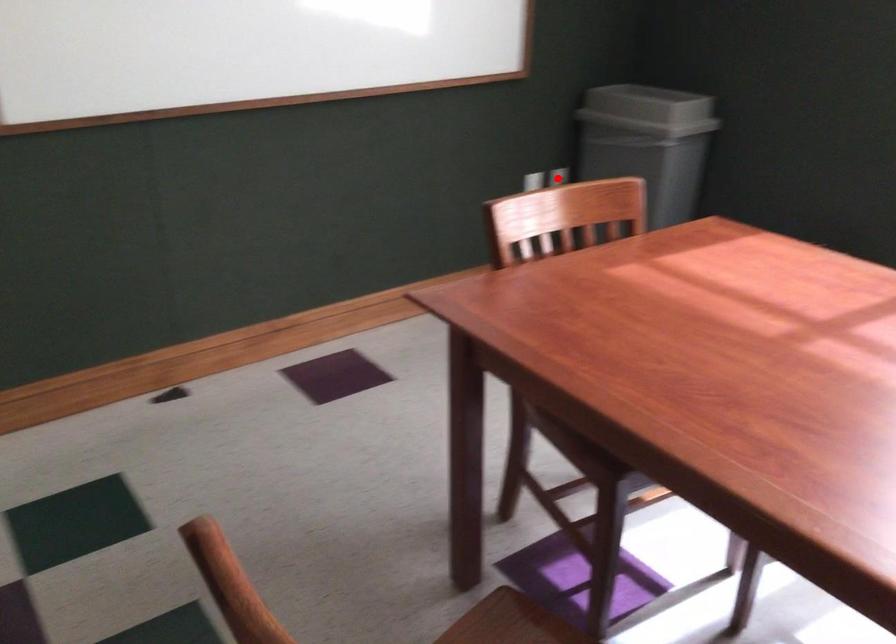
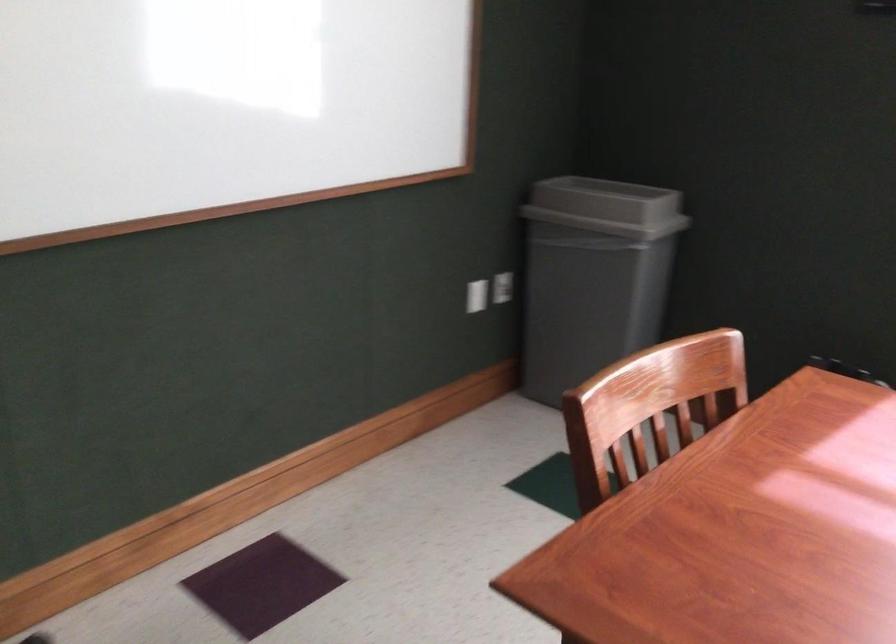
Question: I am providing you with two images of the same scene from different viewpoints. In image1, a red point is highlighted. Considering the same 3D point in image2, which of the following is correct?

Choices:
 (A) It is closer
 (B) It is farther

Answer: (A)